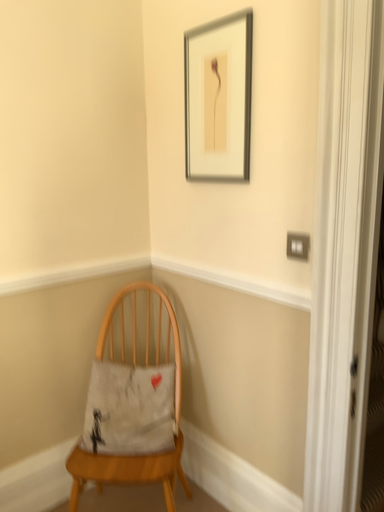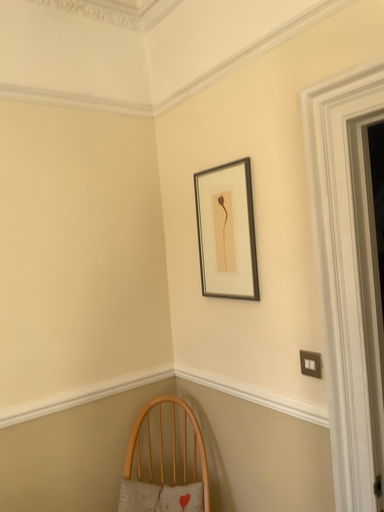
Question: Which way did the camera rotate in the video?

Choices:
 (A) rotated upward
 (B) rotated downward

Answer: (A)